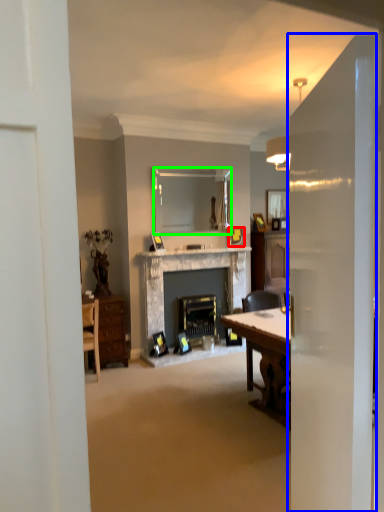
Question: Which object is positioned closest to picture frame (highlighted by a red box)? Select from glass door (highlighted by a blue box) and mirror (highlighted by a green box).

Choices:
 (A) glass door
 (B) mirror

Answer: (B)